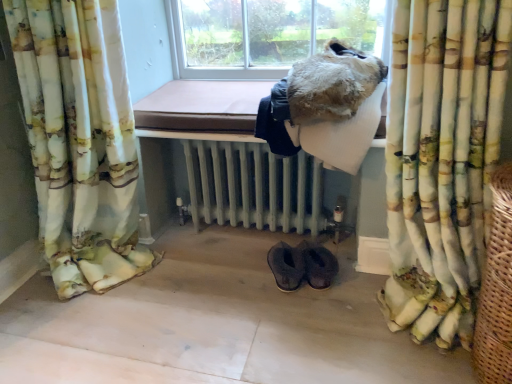
The image size is (512, 384). I want to click on free space to the right of floral fabric curtain at left, which appears as the 1th curtain when viewed from the left, so click(x=194, y=290).